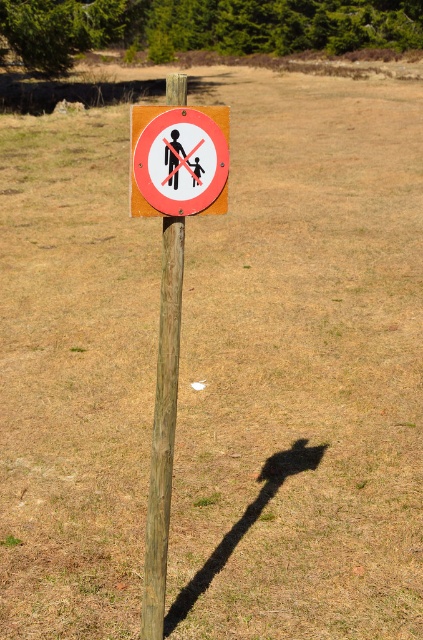
Is red plastic sign at center smaller than wooden post at center?

Correct, red plastic sign at center occupies less space than wooden post at center.

What are the coordinates of `red plastic sign at center` in the screenshot? It's located at (178, 161).

This screenshot has width=423, height=640. In order to click on red plastic sign at center in this screenshot , I will do `click(178, 161)`.